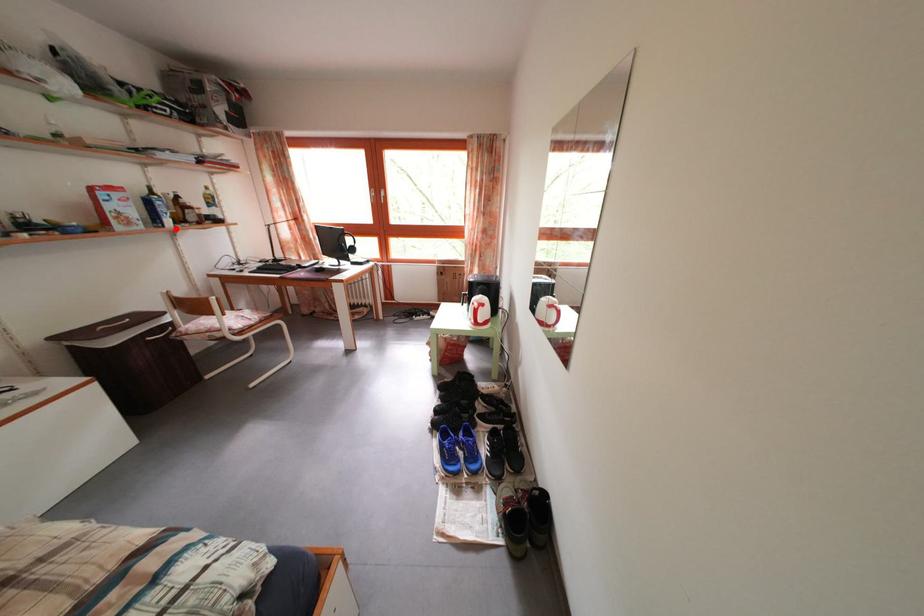
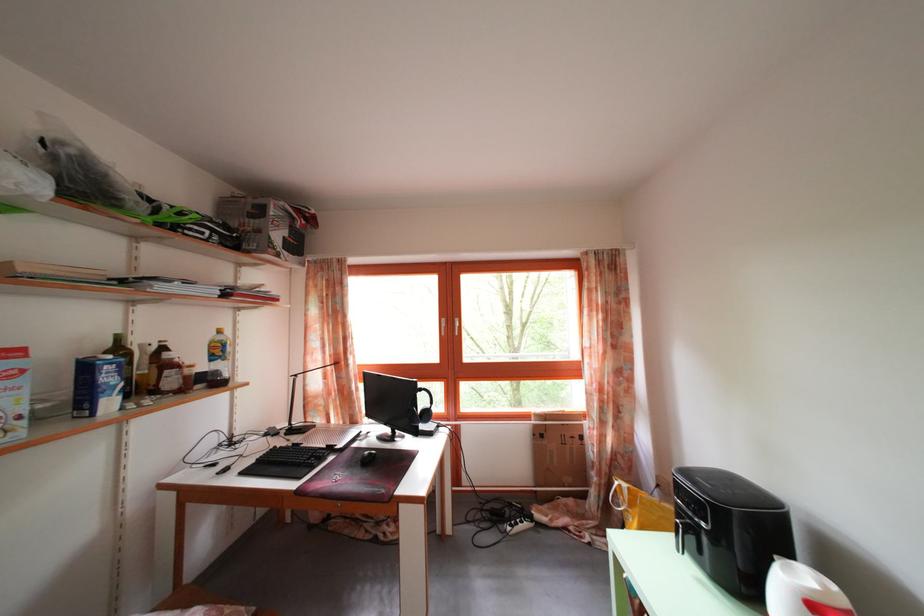
Find the pixel in the second image that matches the highlighted location in the first image.

(117, 410)